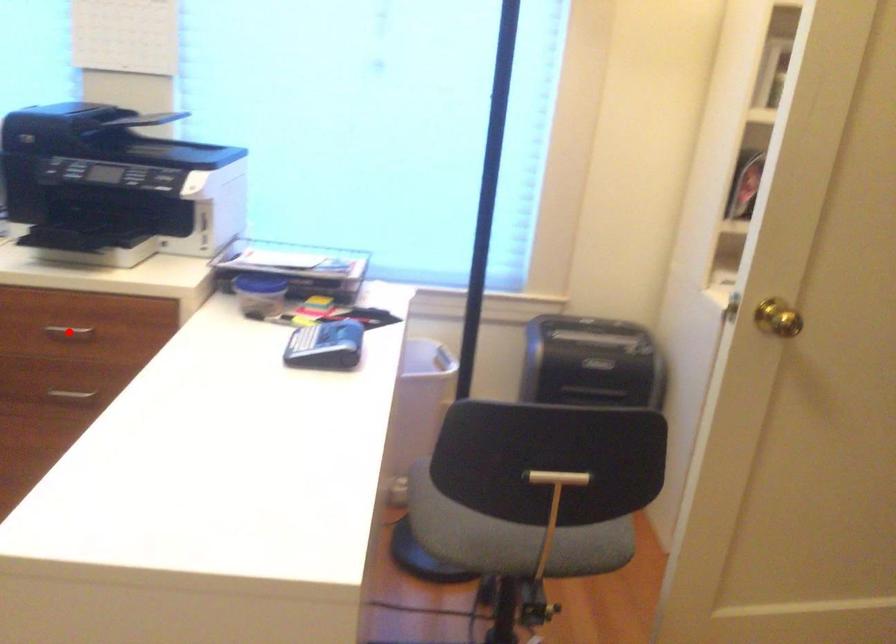
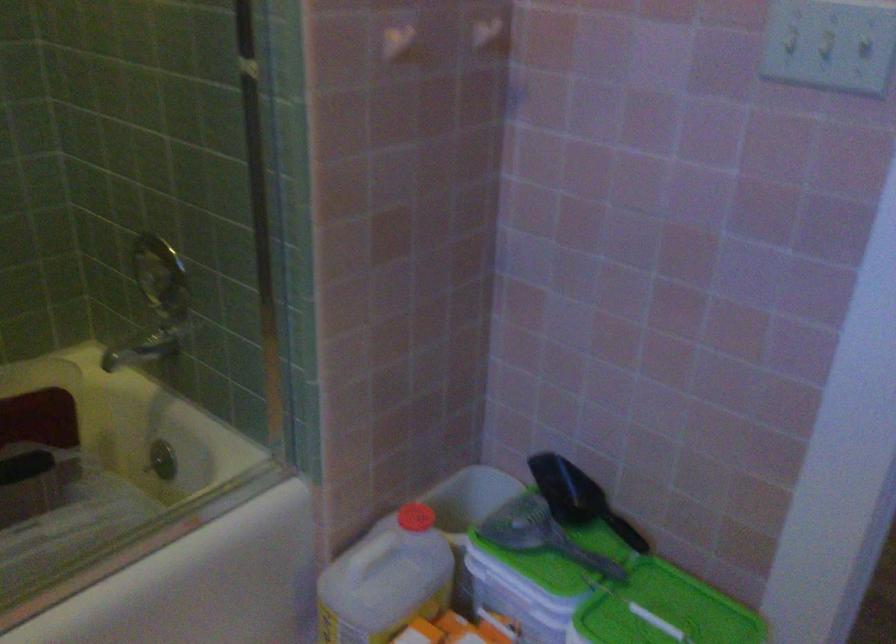
Question: I am providing you with two images of the same scene from different viewpoints. A red point is marked on the first image. Can you still see the location of the red point in image 2?

Choices:
 (A) Yes
 (B) No

Answer: (B)